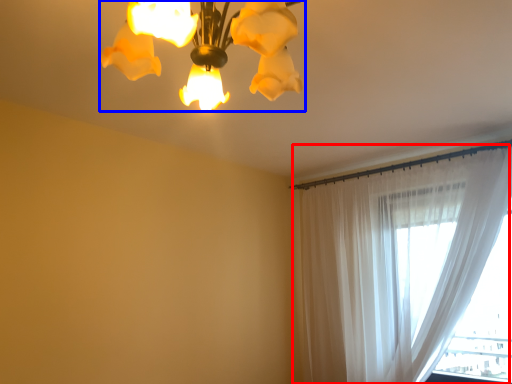
Question: Which object is closer to the camera taking this photo, curtain (highlighted by a red box) or lamp (highlighted by a blue box)?

Choices:
 (A) curtain
 (B) lamp

Answer: (B)